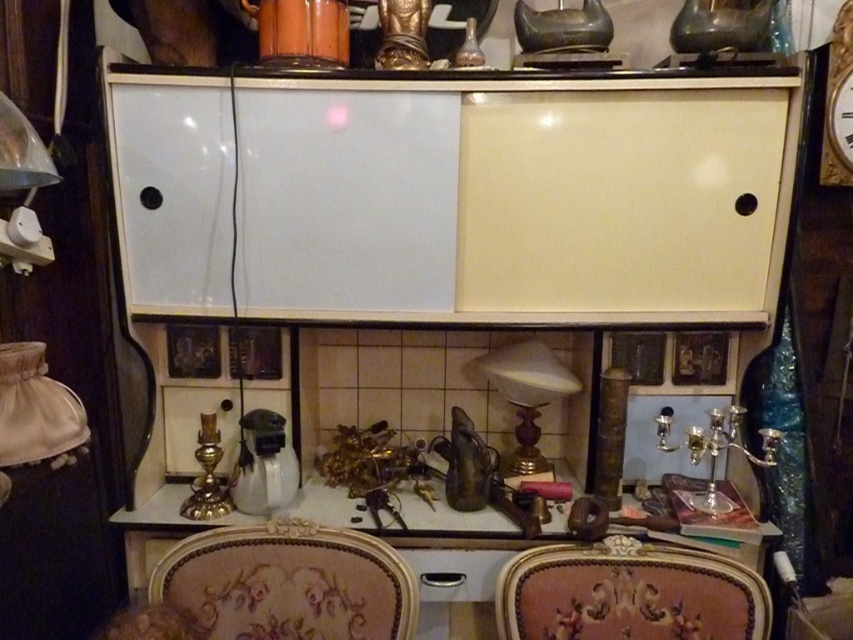
Question: Does velvet upholstered chair at lower center appear over velvet floral chair at center?

Choices:
 (A) no
 (B) yes

Answer: (B)

Question: Which point is closer to the camera taking this photo?

Choices:
 (A) (297, 100)
 (B) (397, 582)
 (C) (544, 461)
 (D) (656, 573)

Answer: (B)

Question: Considering the real-world distances, which object is farthest from the velvet upholstered chair at lower center?

Choices:
 (A) metallic silver drawer at center
 (B) matte glass lamp at center
 (C) metallic brass table at center

Answer: (B)

Question: Among these points, which one is nearest to the camera?

Choices:
 (A) (469, 570)
 (B) (56, 381)

Answer: (B)

Question: Is matte glass lamp at center thinner than gold metallic clock at upper right?

Choices:
 (A) yes
 (B) no

Answer: (B)

Question: Does white glossy cabinet at upper center lie in front of velvet upholstered chair at lower center?

Choices:
 (A) no
 (B) yes

Answer: (A)